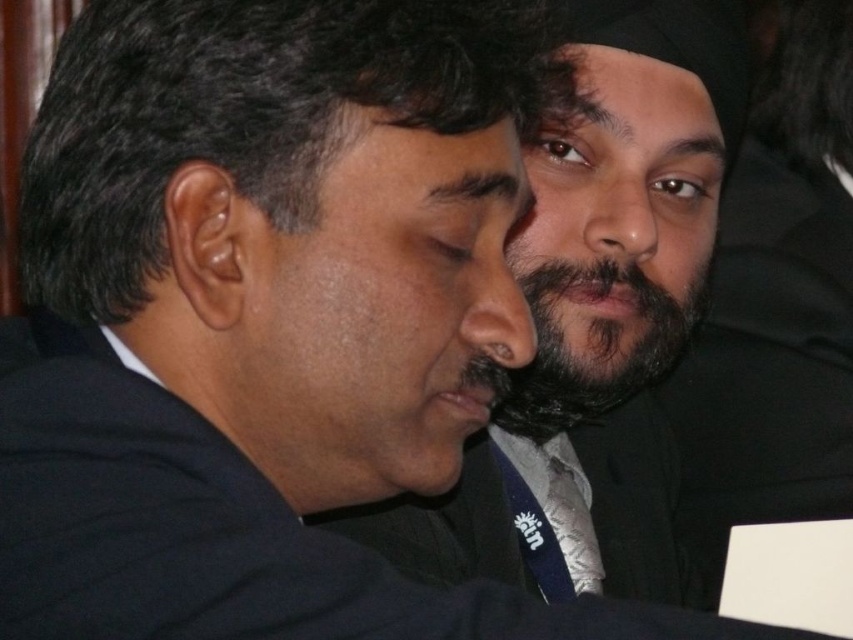
Can you confirm if black matte suit at center is shorter than dark brown fuzzy beard at center?

No.

At what (x,y) coordinates should I click in order to perform the action: click on black matte suit at center. Please return your answer as a coordinate pair (x, y). This screenshot has width=853, height=640. Looking at the image, I should click on (595, 307).

The width and height of the screenshot is (853, 640). What are the coordinates of `black matte suit at center` in the screenshot? It's located at (595, 307).

Who is taller, silver metallic tie at center or navy blue silk tie at lower center?

navy blue silk tie at lower center

Is silver metallic tie at center behind navy blue silk tie at lower center?

Yes.

Who is more distant from viewer, [578,509] or [543,588]?

Positioned behind is point [578,509].

Where is `silver metallic tie at center`? silver metallic tie at center is located at coordinates (572, 516).

Is point (701, 154) positioned in front of point (531, 524)?

No, it is behind (531, 524).

Describe the element at coordinates (595, 307) in the screenshot. Image resolution: width=853 pixels, height=640 pixels. I see `black matte suit at center` at that location.

At what (x,y) coordinates should I click in order to perform the action: click on black matte suit at center. Please return your answer as a coordinate pair (x, y). Image resolution: width=853 pixels, height=640 pixels. Looking at the image, I should click on (595, 307).